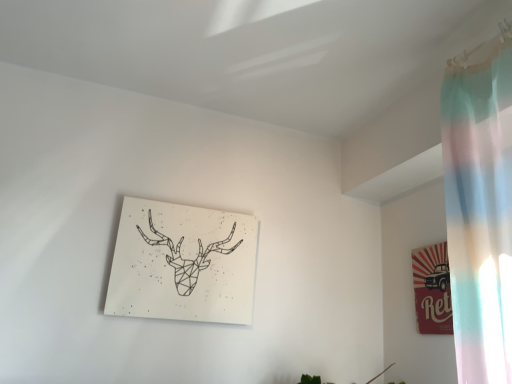
This screenshot has width=512, height=384. What do you see at coordinates (480, 213) in the screenshot?
I see `translucent fabric curtain at right` at bounding box center [480, 213].

The height and width of the screenshot is (384, 512). I want to click on translucent fabric curtain at right, so click(x=480, y=213).

You are a GUI agent. You are given a task and a screenshot of the screen. Output one action in this format:
    pyautogui.click(x=<x>, y=<y>)
    Task: Click on the translucent fabric curtain at right
    This screenshot has height=384, width=512.
    Given the screenshot: What is the action you would take?
    pyautogui.click(x=480, y=213)